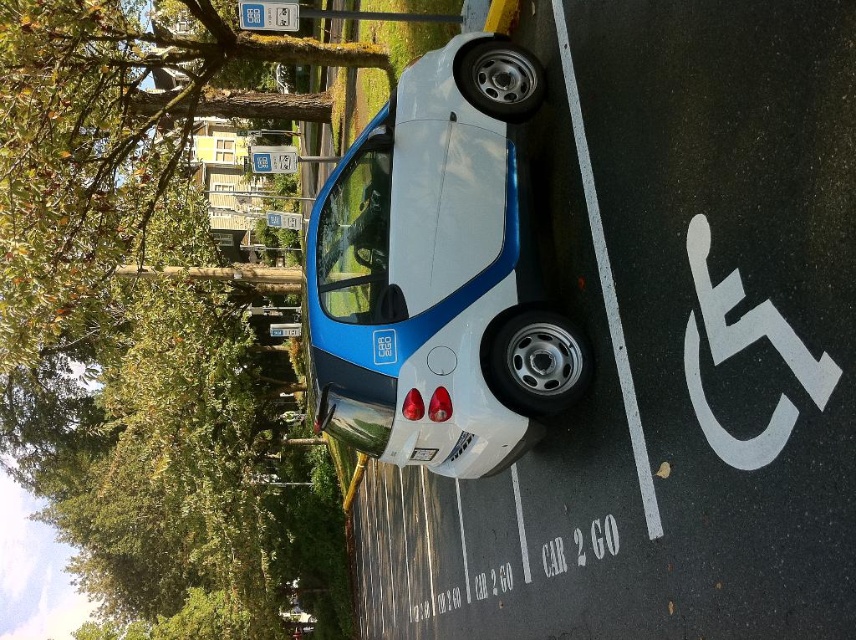
Which is in front, point (343, 388) or point (563, 564)?

Positioned in front is point (343, 388).

Is point (324, 269) less distant than point (495, 589)?

Yes, point (324, 269) is closer to viewer.

The width and height of the screenshot is (856, 640). I want to click on metallic blue car at center, so click(x=437, y=275).